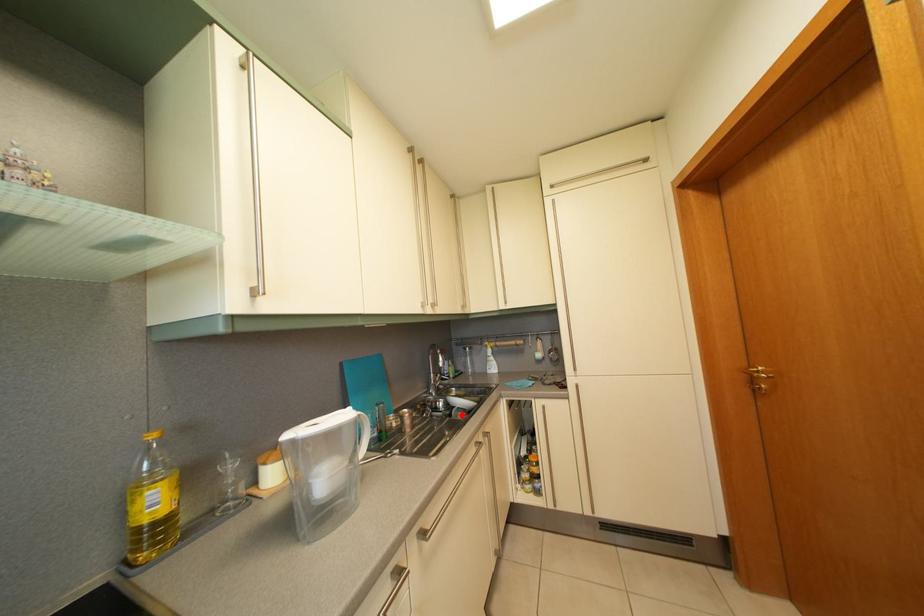
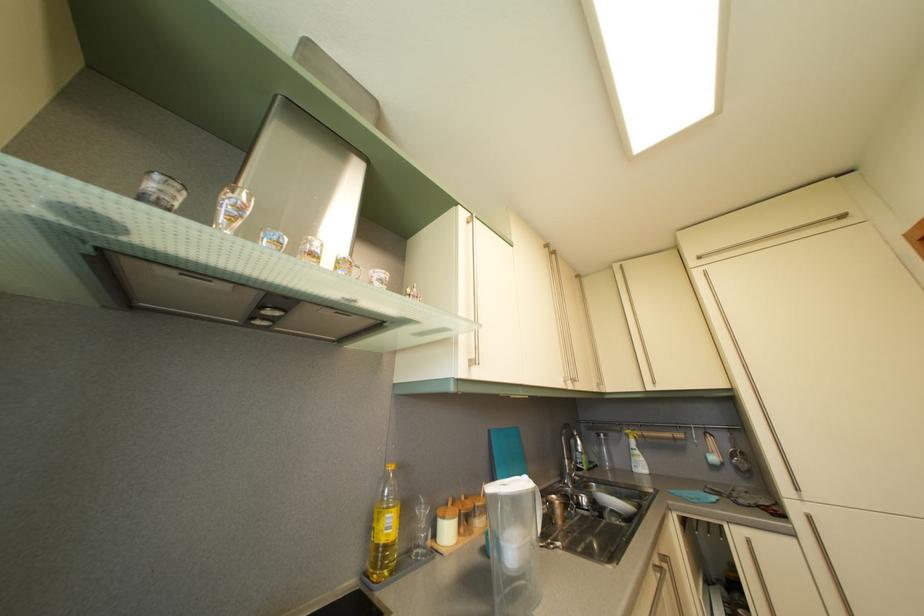
The point at the highlighted location is marked in the first image. Where is the corresponding point in the second image?

(613, 516)